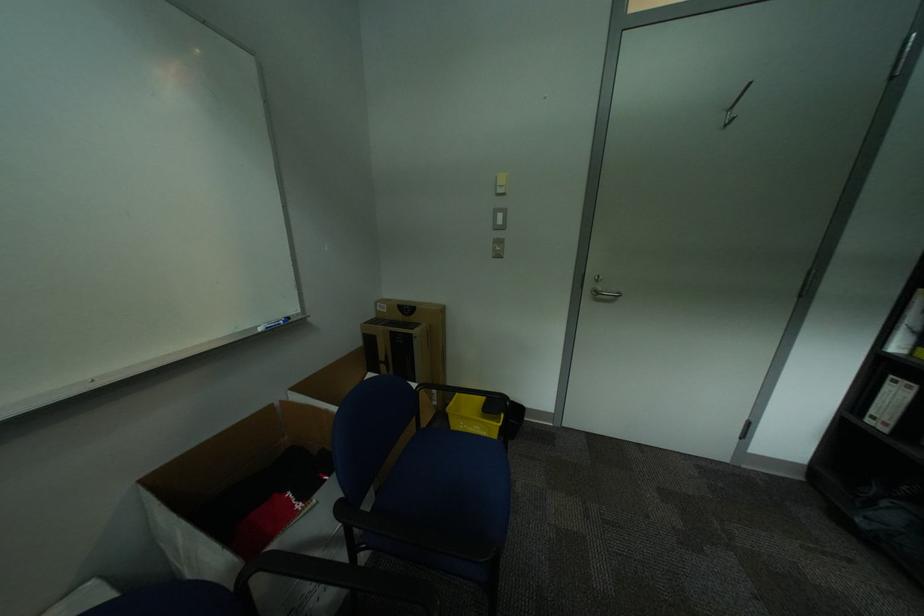
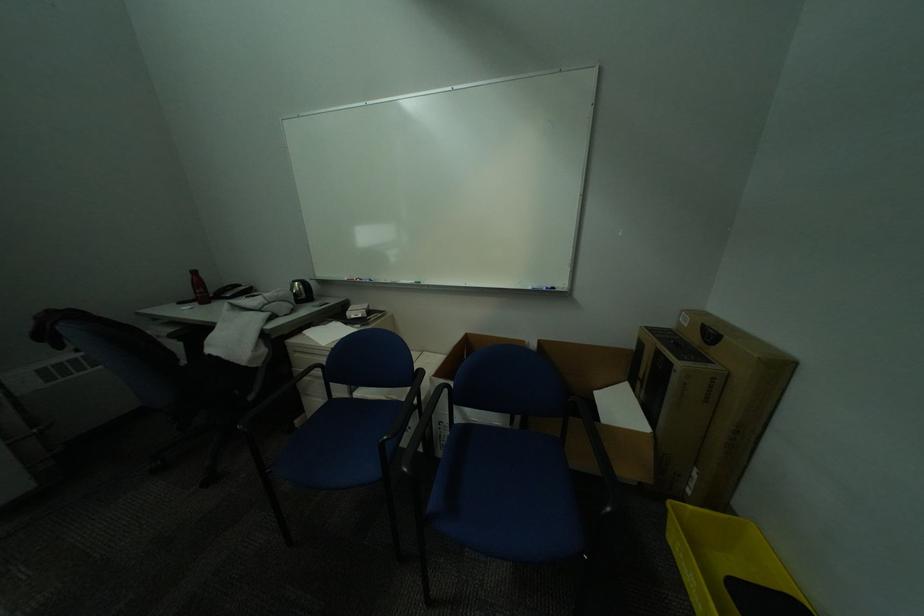
Find the pixel in the second image that matches the point at 272,330 in the first image.

(541, 289)